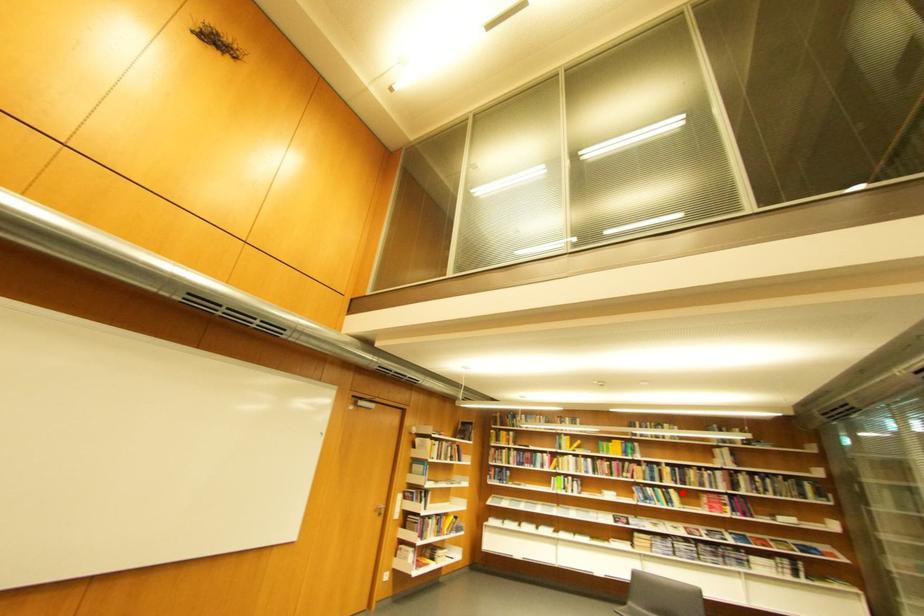
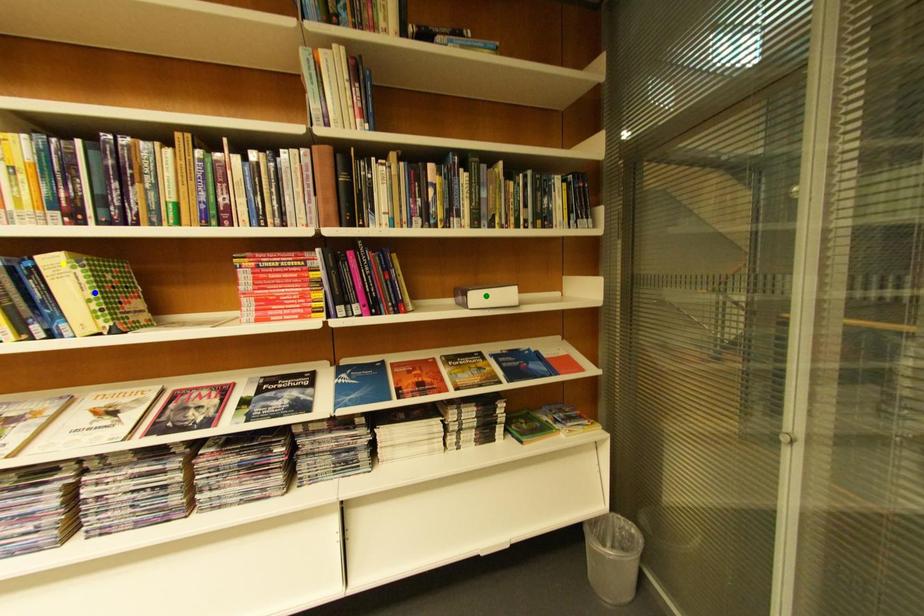
Question: I am providing you with two images of the same scene from different viewpoints. A red point is marked on the first image. You are given multiple points on the second image. Can you choose the point in image 2 that corresponds to the point in image 1?

Choices:
 (A) blue point
 (B) yellow point
 (C) green point

Answer: (B)